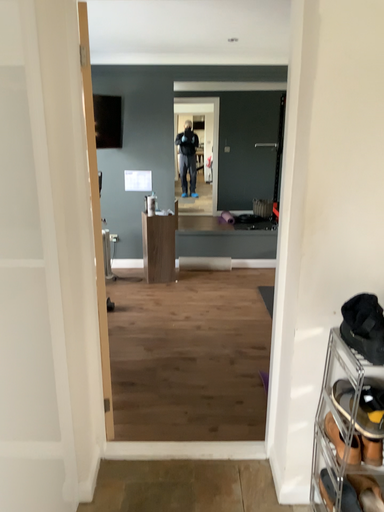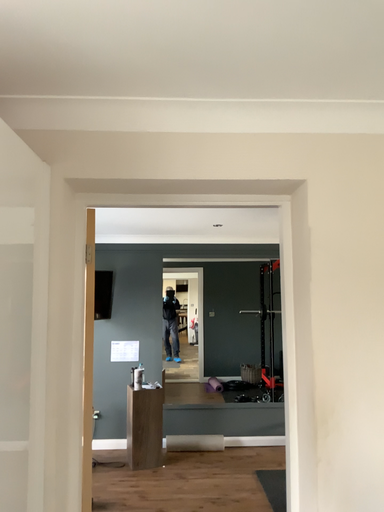
Question: How did the camera likely rotate when shooting the video?

Choices:
 (A) rotated downward
 (B) rotated upward

Answer: (B)